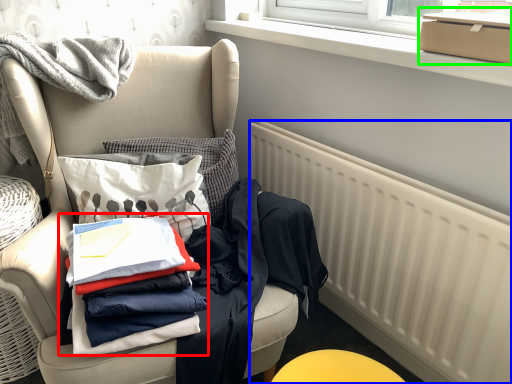
Question: Which object is the farthest from clothing (highlighted by a red box)? Choose among these: radiator (highlighted by a blue box) or box (highlighted by a green box).

Choices:
 (A) radiator
 (B) box

Answer: (B)